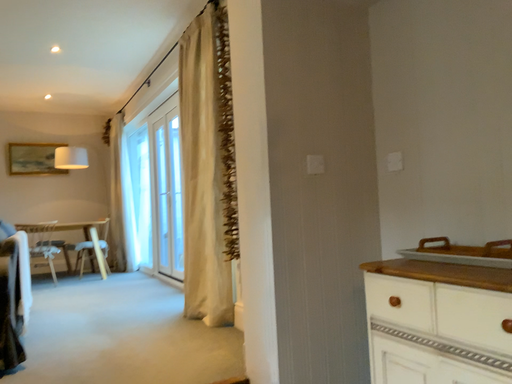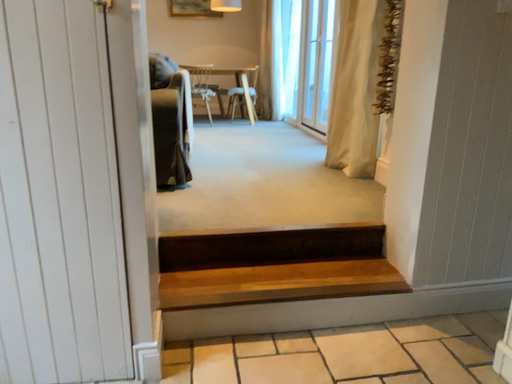
Question: How did the camera likely rotate when shooting the video?

Choices:
 (A) rotated right
 (B) rotated left

Answer: (B)